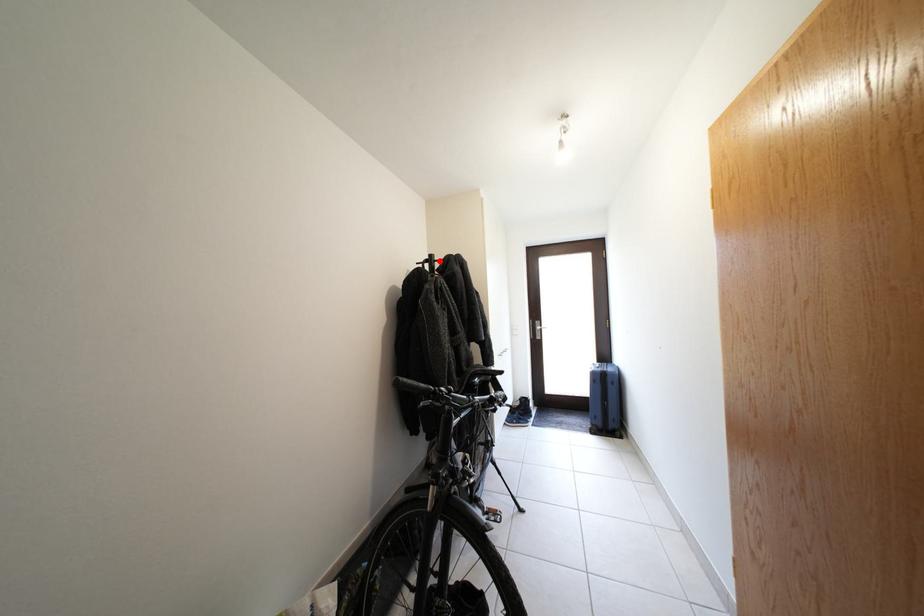
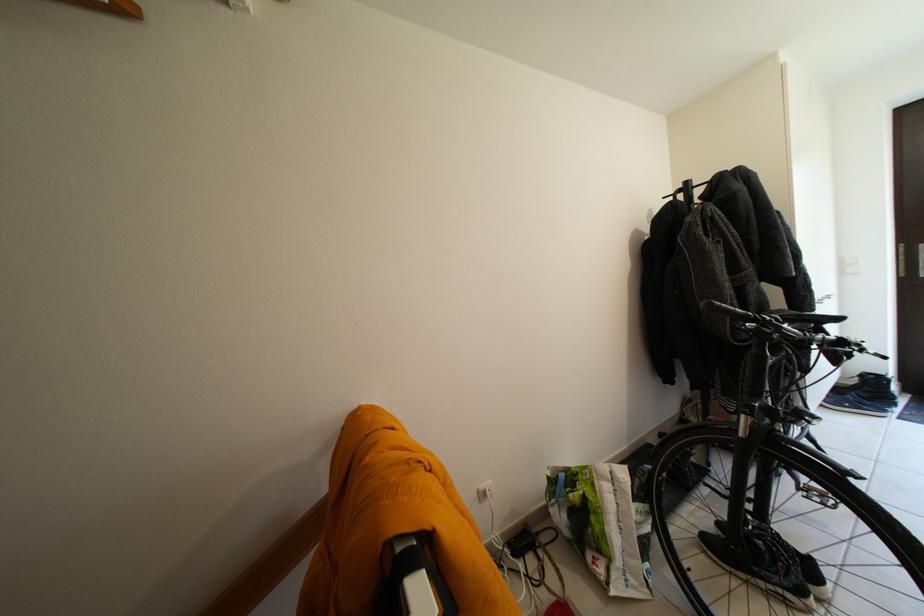
Locate, in the second image, the point that corresponds to the highlighted location in the first image.

(696, 188)